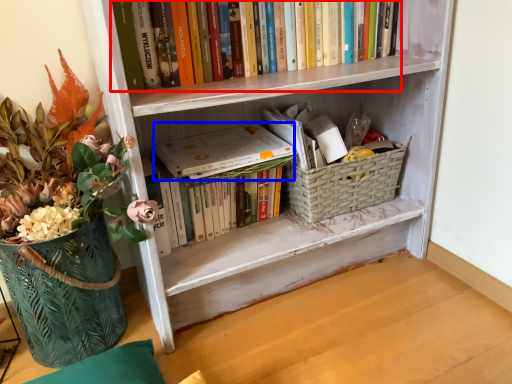
Question: Which object is further to the camera taking this photo, book (highlighted by a red box) or paperback book (highlighted by a blue box)?

Choices:
 (A) book
 (B) paperback book

Answer: (B)